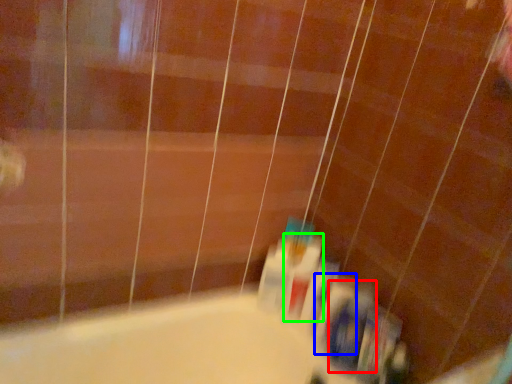
Question: Which object is positioned closest to toiletry (highlighted by a red box)? Select from toiletry (highlighted by a blue box) and mouthwash (highlighted by a green box).

Choices:
 (A) toiletry
 (B) mouthwash

Answer: (A)